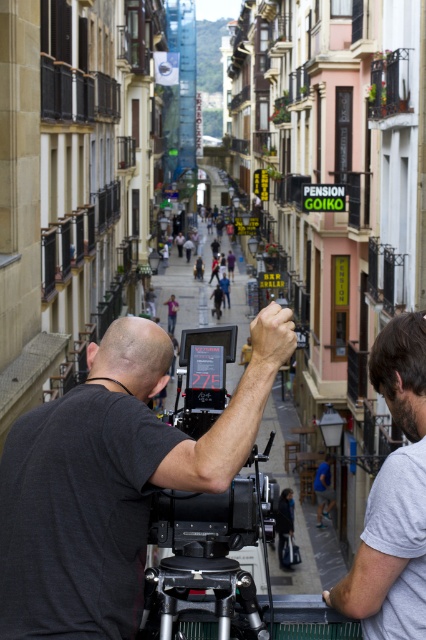
Based on the photo, based on the coordinates provided in the description, where is the black matte camera at center located in the image?

The black matte camera at center is located at point coordinates of (x=112, y=480).

You are standing at point [259,611] and want to walk to point [166,356]. Is the path directly in front of you or behind you?

The path to point [166,356] is directly in front of you because it is behind point [259,611] where you are standing.

You are a photographer trying to set up your equipment. You have a black matte camera at center and a gray cotton shirt at right. Which item takes up more space in the scene?

The gray cotton shirt at right takes up more space in the scene because the black matte camera at center is smaller than it.